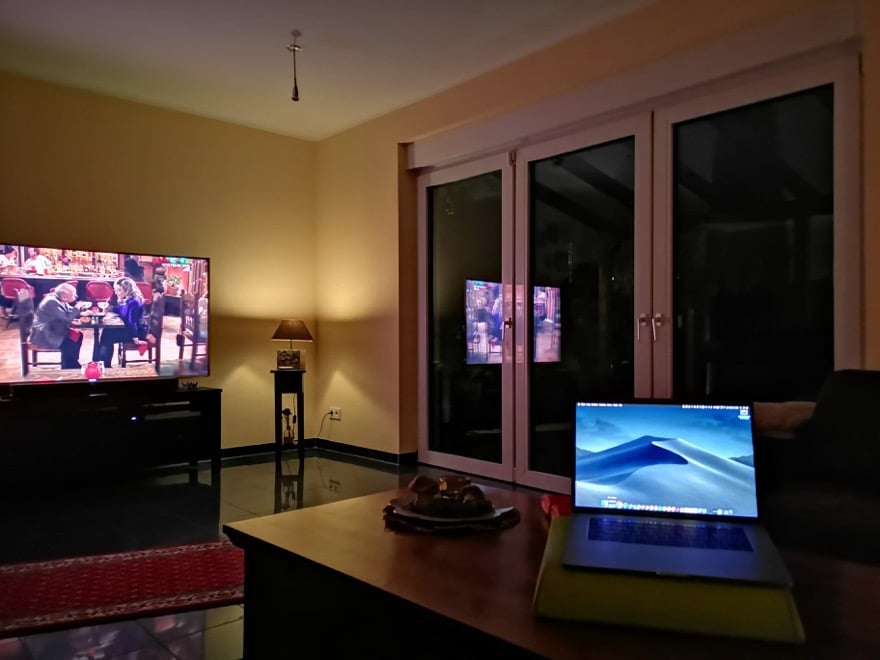
The width and height of the screenshot is (880, 660). What are the coordinates of `frame` in the screenshot? It's located at (655, 323).